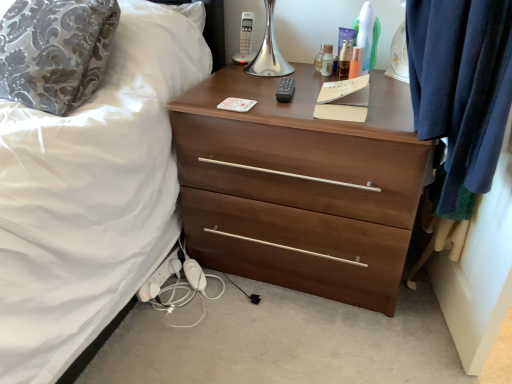
Find the location of `free space that is to the left of clear plastic bottle at upper center, placed as the 4th toiletry when sorted from right to left`. free space that is to the left of clear plastic bottle at upper center, placed as the 4th toiletry when sorted from right to left is located at coordinates (272, 71).